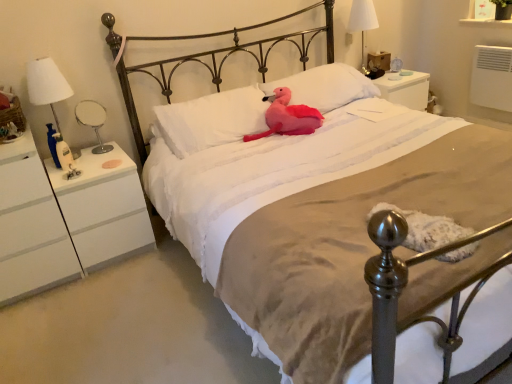
Question: Considering their positions, is white soft pillow at center, which is the 1th pillow from right to left, located in front of or behind pink plush toy at center?

Choices:
 (A) behind
 (B) front

Answer: (A)

Question: Is white soft pillow at center, which is the 1th pillow from right to left, bigger or smaller than pink plush toy at center?

Choices:
 (A) big
 (B) small

Answer: (A)

Question: Which is nearer to the white fabric lampshade at upper right, arranged as the first bedside lamp when viewed from the top?

Choices:
 (A) metallic mirror at left, which is the 3th bedside lamp from top to bottom
 (B) white soft pillow at center, which is the 1th pillow from right to left
 (C) white soft pillow at center, which is counted as the second pillow, starting from the right
 (D) white matte nightstand at left
 (E) white fabric lampshade at left, acting as the 2th bedside lamp starting from the bottom

Answer: (B)

Question: Considering the real-world distances, which object is farthest from the white fabric lampshade at left, the 1th bedside lamp viewed from the front?

Choices:
 (A) white matte nightstand at left
 (B) pink plush toy at center
 (C) white soft pillow at center, which is counted as the second pillow, starting from the right
 (D) white soft pillow at center, the second pillow in the left-to-right sequence
 (E) white fabric lampshade at upper right, the third bedside lamp in the left-to-right sequence

Answer: (E)